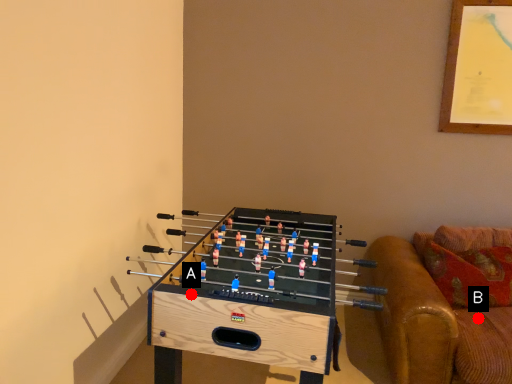
Question: Two points are circled on the image, labeled by A and B beside each circle. Among these points, which one is nearest to the camera?

Choices:
 (A) A is closer
 (B) B is closer

Answer: (A)